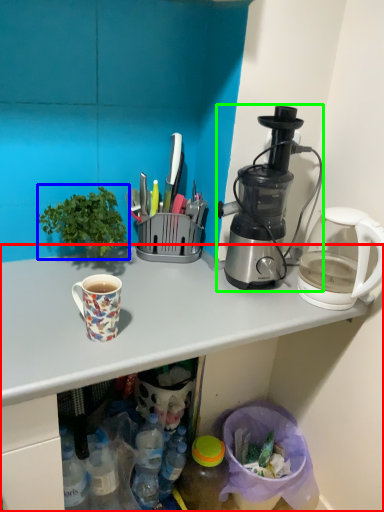
Question: Based on their relative distances, which object is nearer to desk (highlighted by a red box)? Choose from houseplant (highlighted by a blue box) and blender (highlighted by a green box).

Choices:
 (A) houseplant
 (B) blender

Answer: (B)